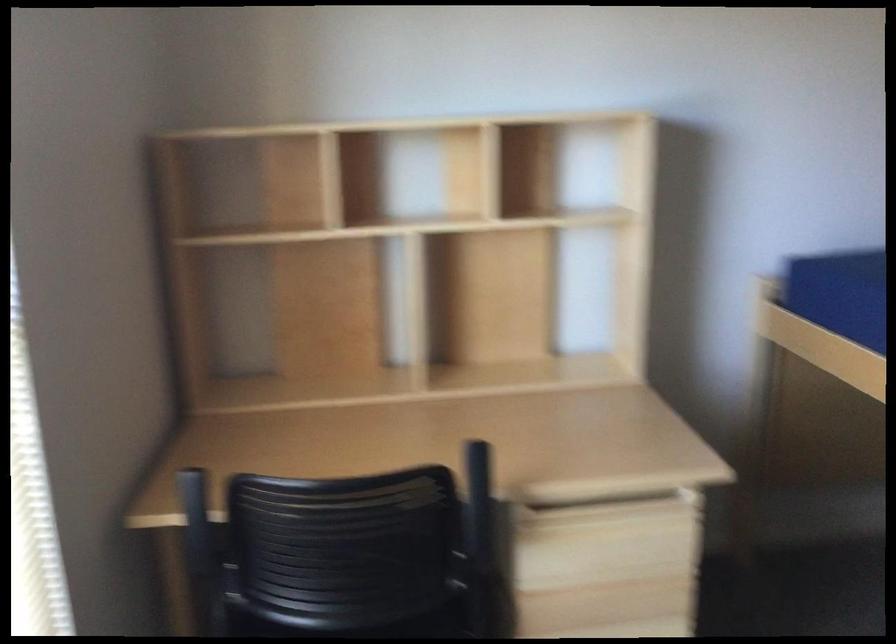
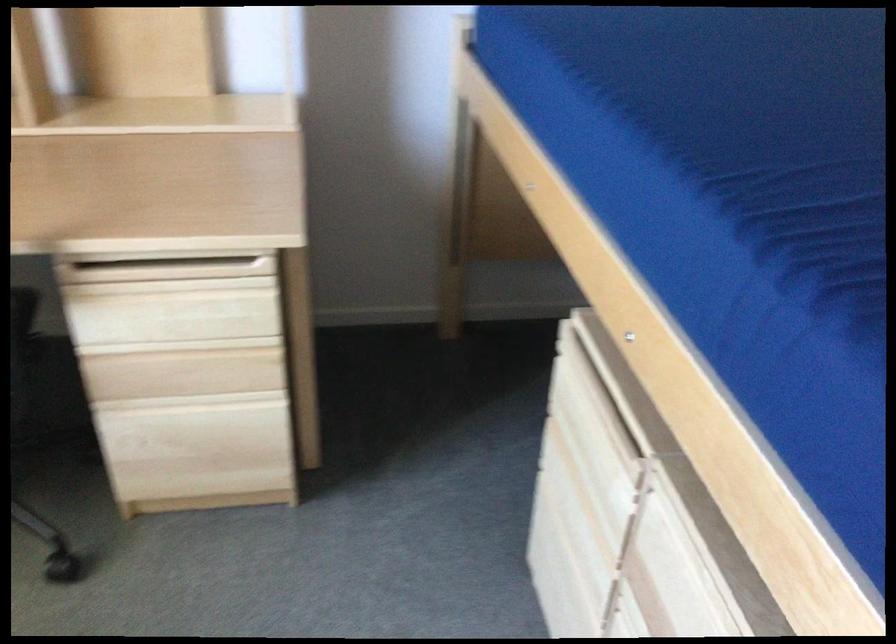
The point at [606,513] is marked in the first image. Where is the corresponding point in the second image?

(166, 270)